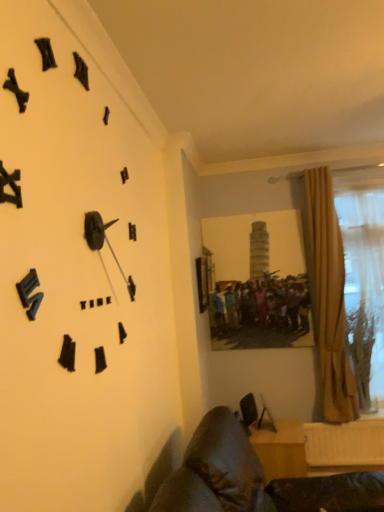
Question: Is leather couch at lower left, which is the second furniture in back-to-front order, aimed at black matte clock at upper left?

Choices:
 (A) no
 (B) yes

Answer: (A)

Question: From a real-world perspective, is leather couch at lower left, which is the first furniture from front to back, positioned over black matte clock at upper left based on gravity?

Choices:
 (A) no
 (B) yes

Answer: (A)

Question: Is the depth of leather couch at lower left, which is the second furniture in back-to-front order, less than that of black matte clock at upper left?

Choices:
 (A) yes
 (B) no

Answer: (B)

Question: Can you confirm if leather couch at lower left, which is the second furniture in back-to-front order, is bigger than black matte clock at upper left?

Choices:
 (A) no
 (B) yes

Answer: (B)

Question: Considering the positions of leather couch at lower left, which is the second furniture in back-to-front order, and translucent fabric curtain at right in the image, is leather couch at lower left, which is the second furniture in back-to-front order, taller or shorter than translucent fabric curtain at right?

Choices:
 (A) short
 (B) tall

Answer: (A)

Question: In the image, is leather couch at lower left, which is the first furniture from front to back, on the left side or the right side of translucent fabric curtain at right?

Choices:
 (A) right
 (B) left

Answer: (B)

Question: In terms of width, does leather couch at lower left, which is the second furniture in back-to-front order, look wider or thinner when compared to translucent fabric curtain at right?

Choices:
 (A) wide
 (B) thin

Answer: (A)

Question: Is point (236, 438) positioned closer to the camera than point (367, 380)?

Choices:
 (A) farther
 (B) closer

Answer: (B)

Question: Considering the positions of wooden desk at lower right, arranged as the 1th furniture when viewed from the back, and leather couch at lower left, which is the second furniture in back-to-front order, in the image, is wooden desk at lower right, arranged as the 1th furniture when viewed from the back, wider or thinner than leather couch at lower left, which is the second furniture in back-to-front order,?

Choices:
 (A) wide
 (B) thin

Answer: (B)

Question: Is point (289, 446) closer or farther from the camera than point (274, 484)?

Choices:
 (A) closer
 (B) farther

Answer: (B)

Question: Considering the relative positions of wooden desk at lower right, arranged as the 1th furniture when viewed from the back, and leather couch at lower left, which is the second furniture in back-to-front order, in the image provided, is wooden desk at lower right, arranged as the 1th furniture when viewed from the back, to the left or to the right of leather couch at lower left, which is the second furniture in back-to-front order,?

Choices:
 (A) right
 (B) left

Answer: (A)

Question: From the image's perspective, relative to leather couch at lower left, which is the first furniture from front to back, is wooden desk at lower right, arranged as the 1th furniture when viewed from the back, above or below?

Choices:
 (A) below
 (B) above

Answer: (A)

Question: Is point (198, 443) closer or farther from the camera than point (324, 328)?

Choices:
 (A) closer
 (B) farther

Answer: (A)

Question: Which is correct: leather couch at lower left, which is the second furniture in back-to-front order, is inside beige fabric curtain at right, or outside of it?

Choices:
 (A) inside
 (B) outside

Answer: (B)